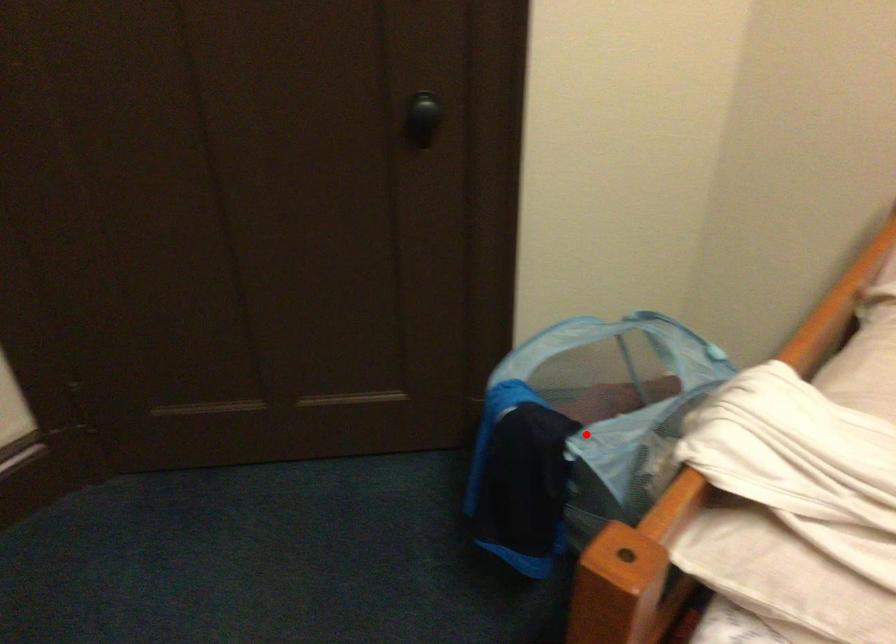
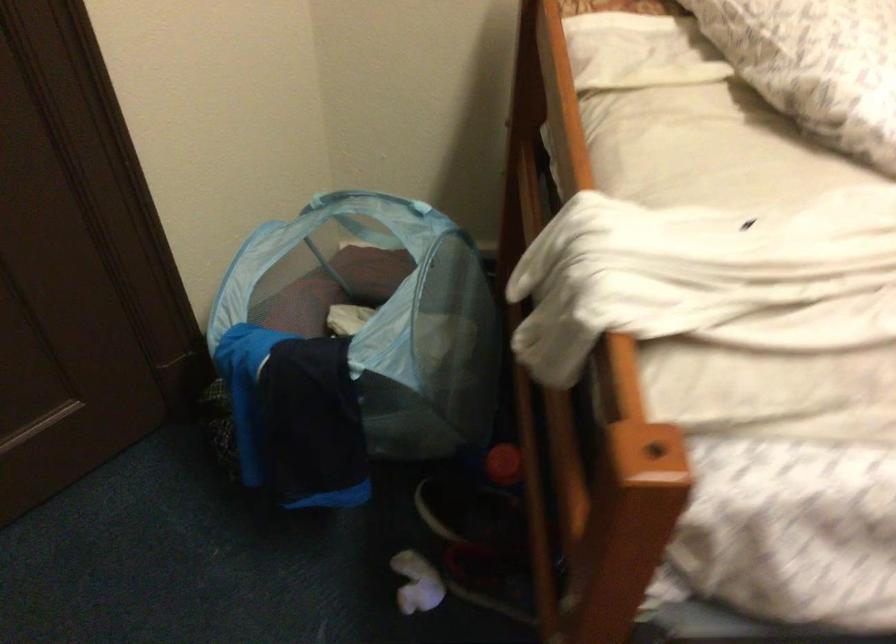
Question: I am providing you with two images of the same scene from different viewpoints. In image1, a red point is highlighted. Considering the same 3D point in image2, which of the following is correct?

Choices:
 (A) It is closer
 (B) It is farther

Answer: (A)